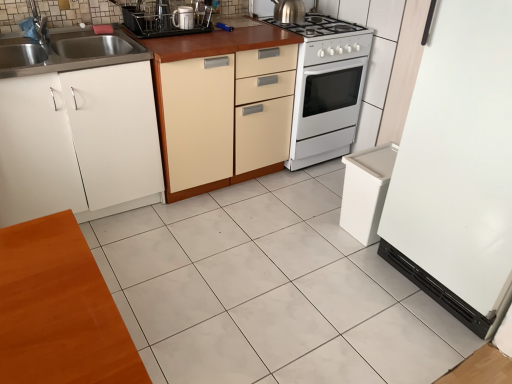
Question: Looking at the image, does white glossy tile at center seem bigger or smaller compared to metallic stainless steel dish rack at upper center, positioned as the 1th appliance in left-to-right order?

Choices:
 (A) small
 (B) big

Answer: (B)

Question: Considering the positions of white glossy tile at center and metallic stainless steel dish rack at upper center, positioned as the 1th appliance in left-to-right order, in the image, is white glossy tile at center wider or thinner than metallic stainless steel dish rack at upper center, positioned as the 1th appliance in left-to-right order,?

Choices:
 (A) thin
 (B) wide

Answer: (B)

Question: Estimate the real-world distances between objects in this image. Which object is farther from the white glossy gas stove at upper center?

Choices:
 (A) metallic stainless steel dish rack at upper center, positioned as the 1th appliance in left-to-right order
 (B) white matte cabinet at left, which is the 2th cabinetry from right to left
 (C) white glossy refrigerator at right, positioned as the 1th appliance in right-to-left order
 (D) beige wood cabinet at center, which is the 1th cabinetry in right-to-left order
 (E) white glossy stove at center

Answer: (B)

Question: Considering the real-world distances, which object is farthest from the polished stainless steel kettle at upper center, acting as the second kitchen appliance starting from the left?

Choices:
 (A) white glossy coffee maker at center, which is the second kitchen appliance in back-to-front order
 (B) white glossy gas stove at upper center
 (C) white glossy refrigerator at right, positioned as the second appliance in left-to-right order
 (D) white matte cabinet at left, which is the 2th cabinetry from right to left
 (E) white glossy stove at center

Answer: (C)